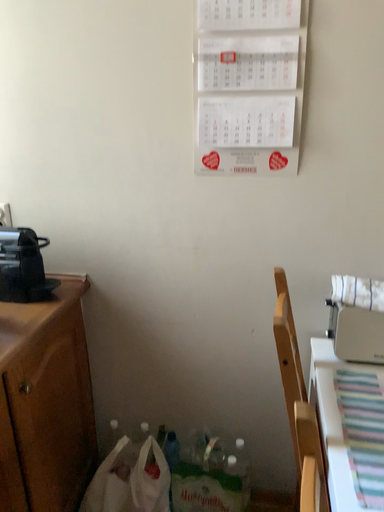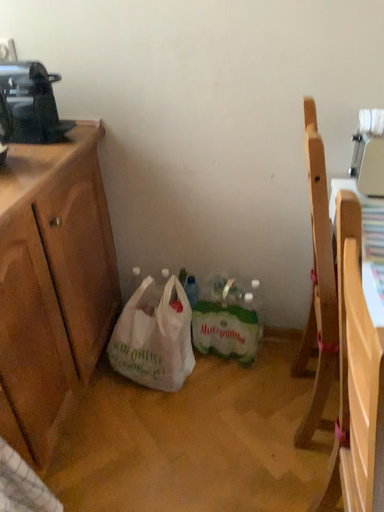
Question: How did the camera likely rotate when shooting the video?

Choices:
 (A) rotated upward
 (B) rotated downward

Answer: (B)